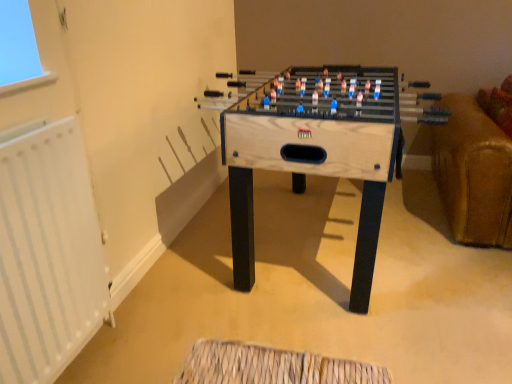
Identify the location of white metallic radiator at left. (48, 254).

What do you see at coordinates (48, 254) in the screenshot?
I see `white metallic radiator at left` at bounding box center [48, 254].

Measure the distance between point (56, 276) and camera.

They are 1.23 meters apart.

What do you see at coordinates (315, 150) in the screenshot?
I see `wooden foosball table at center` at bounding box center [315, 150].

At what (x,y) coordinates should I click in order to perform the action: click on wooden foosball table at center. Please return your answer as a coordinate pair (x, y). This screenshot has width=512, height=384. Looking at the image, I should click on (315, 150).

I want to click on white metallic radiator at left, so click(48, 254).

Considering the relative positions of wooden foosball table at center and white metallic radiator at left in the image provided, is wooden foosball table at center to the left of white metallic radiator at left from the viewer's perspective?

No.

Is wooden foosball table at center in front of or behind white metallic radiator at left in the image?

Clearly, wooden foosball table at center is behind white metallic radiator at left.

Between point (231, 115) and point (69, 240), which one is positioned in front?

Positioned in front is point (69, 240).

From the image's perspective, is wooden foosball table at center on top of white metallic radiator at left?

Correct, wooden foosball table at center appears higher than white metallic radiator at left in the image.

From a real-world perspective, between wooden foosball table at center and white metallic radiator at left, who is vertically higher?

white metallic radiator at left.

Looking at this image, is wooden foosball table at center wider than white metallic radiator at left?

Indeed, wooden foosball table at center has a greater width compared to white metallic radiator at left.

Can you confirm if wooden foosball table at center is shorter than white metallic radiator at left?

Yes.

Looking at this image, in terms of size, does wooden foosball table at center appear bigger or smaller than white metallic radiator at left?

Clearly, wooden foosball table at center is larger in size than white metallic radiator at left.

Is wooden foosball table at center located outside white metallic radiator at left?

That's correct, wooden foosball table at center is outside of white metallic radiator at left.

Is wooden foosball table at center not near white metallic radiator at left?

That's not correct — wooden foosball table at center is a little close to white metallic radiator at left.

Is wooden foosball table at center facing towards white metallic radiator at left?

No, wooden foosball table at center is not turned towards white metallic radiator at left.

How many degrees apart are the facing directions of wooden foosball table at center and white metallic radiator at left?

wooden foosball table at center and white metallic radiator at left are facing 1.41 degrees away from each other.

You are a GUI agent. You are given a task and a screenshot of the screen. Output one action in this format:
    pyautogui.click(x=<x>, y=<y>)
    Task: Click on the table behind the white metallic radiator at left
    The image size is (512, 384).
    Given the screenshot: What is the action you would take?
    pyautogui.click(x=315, y=150)

Is white metallic radiator at left at the left side of wooden foosball table at center?

Yes.

In the image, is white metallic radiator at left positioned in front of or behind wooden foosball table at center?

Clearly, white metallic radiator at left is in front of wooden foosball table at center.

Which is behind, point (21, 201) or point (366, 125)?

The point (366, 125) is farther from the camera.

From the image's perspective, is white metallic radiator at left below wooden foosball table at center?

Yes.

From the picture: From a real-world perspective, is white metallic radiator at left under wooden foosball table at center?

Incorrect, from a real-world perspective, white metallic radiator at left is higher than wooden foosball table at center.

Which object is thinner, white metallic radiator at left or wooden foosball table at center?

white metallic radiator at left.

In terms of height, does white metallic radiator at left look taller or shorter compared to wooden foosball table at center?

Considering their sizes, white metallic radiator at left has more height than wooden foosball table at center.

Consider the image. Between white metallic radiator at left and wooden foosball table at center, which one has larger size?

wooden foosball table at center is bigger.

Is white metallic radiator at left situated inside wooden foosball table at center or outside?

white metallic radiator at left is spatially situated outside wooden foosball table at center.

Are white metallic radiator at left and wooden foosball table at center making contact?

No.

Consider the image. Could you tell me if white metallic radiator at left is facing wooden foosball table at center?

No.

Measure the distance between white metallic radiator at left and wooden foosball table at center.

The distance of white metallic radiator at left from wooden foosball table at center is 33.02 inches.

Where is `table that appears above the white metallic radiator at left (from the image's perspective)`? table that appears above the white metallic radiator at left (from the image's perspective) is located at coordinates (315, 150).

The image size is (512, 384). There is a wooden foosball table at center. In order to click on radiator above it (from a real-world perspective) in this screenshot , I will do `click(48, 254)`.

I want to click on table above the white metallic radiator at left (from the image's perspective), so click(315, 150).